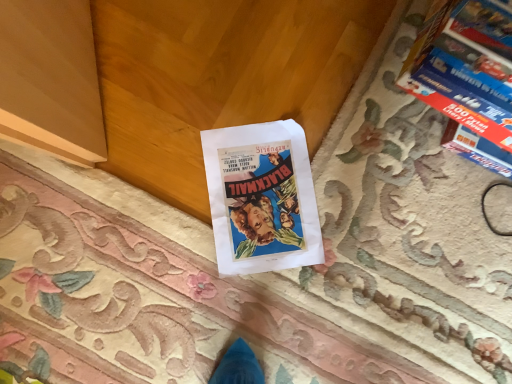
Question: Does blue glossy book at upper right come in front of vintage paper poster at center?

Choices:
 (A) no
 (B) yes

Answer: (B)

Question: From a real-world perspective, is blue glossy book at upper right physically below vintage paper poster at center?

Choices:
 (A) yes
 (B) no

Answer: (B)

Question: Considering the relative sizes of blue glossy book at upper right and vintage paper poster at center in the image provided, is blue glossy book at upper right wider than vintage paper poster at center?

Choices:
 (A) yes
 (B) no

Answer: (A)

Question: From the image's perspective, does blue glossy book at upper right appear lower than vintage paper poster at center?

Choices:
 (A) yes
 (B) no

Answer: (B)

Question: Does blue glossy book at upper right turn towards vintage paper poster at center?

Choices:
 (A) no
 (B) yes

Answer: (A)

Question: Is blue glossy book at upper right oriented away from vintage paper poster at center?

Choices:
 (A) yes
 (B) no

Answer: (B)

Question: Considering the relative positions of vintage paper poster at center and blue glossy book at upper right in the image provided, is vintage paper poster at center to the right of blue glossy book at upper right from the viewer's perspective?

Choices:
 (A) no
 (B) yes

Answer: (A)

Question: Does vintage paper poster at center have a lesser height compared to blue glossy book at upper right?

Choices:
 (A) yes
 (B) no

Answer: (A)

Question: Considering the relative sizes of vintage paper poster at center and blue glossy book at upper right in the image provided, is vintage paper poster at center taller than blue glossy book at upper right?

Choices:
 (A) no
 (B) yes

Answer: (A)

Question: Does vintage paper poster at center have a larger size compared to blue glossy book at upper right?

Choices:
 (A) no
 (B) yes

Answer: (A)

Question: From the image's perspective, would you say vintage paper poster at center is positioned over blue glossy book at upper right?

Choices:
 (A) no
 (B) yes

Answer: (A)

Question: From a real-world perspective, does vintage paper poster at center sit lower than blue glossy book at upper right?

Choices:
 (A) no
 (B) yes

Answer: (B)

Question: Does point (474, 140) appear closer or farther from the camera than point (260, 155)?

Choices:
 (A) farther
 (B) closer

Answer: (B)